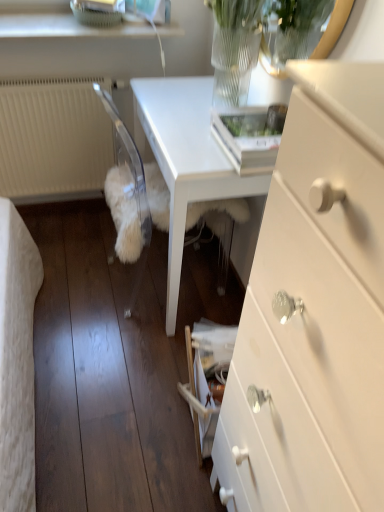
Identify the location of white glossy chest of drawers at center right. The width and height of the screenshot is (384, 512). (315, 309).

What are the coordinates of `white fluffy dog at lower center` in the screenshot? It's located at (124, 213).

Locate an element on the screen. The width and height of the screenshot is (384, 512). white glossy table at center is located at coordinates (186, 159).

In order to face white textured radiator at left, should I rotate leftwards or rightwards?

Rotate your view left by about 17.094°.

This screenshot has width=384, height=512. Find the location of `white glossy chest of drawers at center right`. white glossy chest of drawers at center right is located at coordinates (315, 309).

From a real-world perspective, is white glossy table at center positioned above or below white textured radiator at left?

white glossy table at center is below white textured radiator at left.

Is white glossy table at center situated inside white textured radiator at left or outside?

white glossy table at center is located beyond the bounds of white textured radiator at left.

From the image's perspective, is white glossy table at center positioned above or below white textured radiator at left?

white glossy table at center is below white textured radiator at left.

Is white glossy table at center far away from white textured radiator at left?

They are positioned close to each other.

From a real-world perspective, which object stands above the other?

white glossy chest of drawers at center right.

Between point (160, 221) and point (257, 364), which one is positioned behind?

The point (160, 221) is more distant.

Considering the sizes of objects white fluffy dog at lower center and white glossy chest of drawers at center right in the image provided, who is smaller, white fluffy dog at lower center or white glossy chest of drawers at center right?

Smaller between the two is white glossy chest of drawers at center right.

From their relative heights in the image, would you say white textured radiator at left is taller or shorter than white fluffy dog at lower center?

white textured radiator at left is taller than white fluffy dog at lower center.

From a real-world perspective, is white textured radiator at left below white fluffy dog at lower center?

Incorrect, from a real-world perspective, white textured radiator at left is higher than white fluffy dog at lower center.

Are white textured radiator at left and white fluffy dog at lower center far apart?

white textured radiator at left is actually quite close to white fluffy dog at lower center.

In the scene shown: Which of these two, white textured radiator at left or white fluffy dog at lower center, is smaller?

With smaller size is white textured radiator at left.

From the image's perspective, is white textured radiator at left above white glossy chest of drawers at center right?

Yes, from the image's perspective, white textured radiator at left is over white glossy chest of drawers at center right.

Would you consider white textured radiator at left to be distant from white glossy chest of drawers at center right?

That's right, there is a large distance between white textured radiator at left and white glossy chest of drawers at center right.

Between white textured radiator at left and white glossy chest of drawers at center right, which one has larger size?

With larger size is white glossy chest of drawers at center right.

From a real-world perspective, is white textured radiator at left under white glossy chest of drawers at center right?

Yes.

How many degrees apart are the facing directions of white glossy chest of drawers at center right and white textured radiator at left?

The angle between the facing direction of white glossy chest of drawers at center right and the facing direction of white textured radiator at left is 89.9 degrees.

Does white glossy chest of drawers at center right appear on the right side of white textured radiator at left?

Correct, you'll find white glossy chest of drawers at center right to the right of white textured radiator at left.

Is white glossy chest of drawers at center right taller or shorter than white textured radiator at left?

→ white glossy chest of drawers at center right is taller than white textured radiator at left.

How distant is white glossy chest of drawers at center right from white textured radiator at left?

white glossy chest of drawers at center right is 5.19 feet from white textured radiator at left.

Is point (9, 188) less distant than point (133, 106)?

No, it is not.

Can you confirm if white textured radiator at left is bigger than white glossy table at center?

Actually, white textured radiator at left might be smaller than white glossy table at center.

Does white textured radiator at left appear on the right side of white glossy table at center?

Incorrect, white textured radiator at left is not on the right side of white glossy table at center.

Would you say white glossy table at center is part of white textured radiator at left's contents?

No, white glossy table at center is not a part of white textured radiator at left.

Is white fluffy dog at lower center turned away from white textured radiator at left?

No, white fluffy dog at lower center's orientation is not away from white textured radiator at left.

Are white fluffy dog at lower center and white textured radiator at left beside each other?

white fluffy dog at lower center and white textured radiator at left are clearly separated.

From the image's perspective, which is above, white fluffy dog at lower center or white textured radiator at left?

From the image's view, white textured radiator at left is above.

Which is more to the left, white fluffy dog at lower center or white textured radiator at left?

white textured radiator at left.

I want to click on radiator behind the white glossy table at center, so click(52, 139).

Find the location of a particular element. animal located underneath the white glossy chest of drawers at center right (from a real-world perspective) is located at coordinates (124, 213).

Which object lies further to the anchor point white textured radiator at left, white fluffy dog at lower center or white glossy chest of drawers at center right?

white glossy chest of drawers at center right lies further to white textured radiator at left than the other object.

When comparing their distances from white glossy table at center, does white fluffy dog at lower center or white textured radiator at left seem further?

white textured radiator at left is further to white glossy table at center.

Estimate the real-world distances between objects in this image. Which object is further from white glossy chest of drawers at center right, white glossy table at center or white fluffy dog at lower center?

Among the two, white fluffy dog at lower center is located further to white glossy chest of drawers at center right.

Which object lies nearer to the anchor point white glossy chest of drawers at center right, white textured radiator at left or white glossy table at center?

white glossy table at center is positioned closer to the anchor white glossy chest of drawers at center right.

Estimate the real-world distances between objects in this image. Which object is further from white fluffy dog at lower center, white glossy table at center or white glossy chest of drawers at center right?

white glossy chest of drawers at center right is further to white fluffy dog at lower center.

Estimate the real-world distances between objects in this image. Which object is closer to white glossy table at center, white glossy chest of drawers at center right or white fluffy dog at lower center?

Among the two, white fluffy dog at lower center is located nearer to white glossy table at center.

Estimate the real-world distances between objects in this image. Which object is closer to white glossy chest of drawers at center right, white textured radiator at left or white fluffy dog at lower center?

Based on the image, white fluffy dog at lower center appears to be nearer to white glossy chest of drawers at center right.

When comparing their distances from white textured radiator at left, does white glossy chest of drawers at center right or white glossy table at center seem closer?

white glossy table at center is closer to white textured radiator at left.

What are the coordinates of `animal situated between white textured radiator at left and white glossy table at center from left to right` in the screenshot? It's located at (124, 213).

You are a GUI agent. You are given a task and a screenshot of the screen. Output one action in this format:
    pyautogui.click(x=<x>, y=<y>)
    Task: Click on the table between white glossy chest of drawers at center right and white fluffy dog at lower center in the front-back direction
    This screenshot has height=512, width=384.
    Given the screenshot: What is the action you would take?
    pyautogui.click(x=186, y=159)

The height and width of the screenshot is (512, 384). Identify the location of animal between white glossy chest of drawers at center right and white textured radiator at left along the z-axis. 124,213.

Identify the location of table located between white glossy chest of drawers at center right and white textured radiator at left in the depth direction. The width and height of the screenshot is (384, 512). (186, 159).